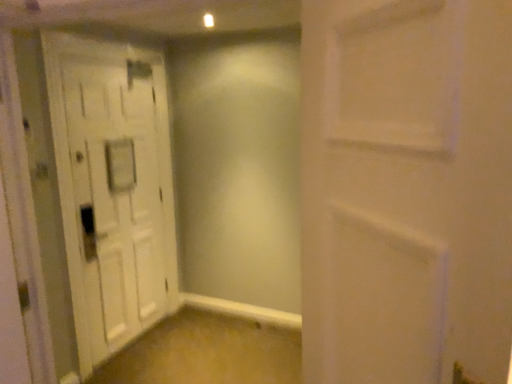
Question: From a real-world perspective, is white matte door at center, acting as the second door starting from the left, positioned above or below white wooden door at left, placed as the first door when sorted from back to front?

Choices:
 (A) below
 (B) above

Answer: (B)

Question: Based on their positions, is white matte door at center, which is the first door from front to back, located to the left or right of white wooden door at left, the first door in the left-to-right sequence?

Choices:
 (A) left
 (B) right

Answer: (B)

Question: Looking at their shapes, would you say white matte door at center, which ranks as the 1th door in right-to-left order, is wider or thinner than white wooden door at left, the 2th door positioned from the right?

Choices:
 (A) thin
 (B) wide

Answer: (A)

Question: Which is correct: white wooden door at left, the first door in the left-to-right sequence, is inside white matte door at center, acting as the second door starting from the left, or outside of it?

Choices:
 (A) outside
 (B) inside

Answer: (A)

Question: In the image, is white wooden door at left, which appears as the second door when viewed from the front, positioned in front of or behind white matte door at center, acting as the second door starting from the left?

Choices:
 (A) behind
 (B) front

Answer: (A)

Question: Is white wooden door at left, placed as the first door when sorted from back to front, bigger or smaller than white matte door at center, the second door from the back?

Choices:
 (A) small
 (B) big

Answer: (B)

Question: Is white wooden door at left, the first door in the left-to-right sequence, taller or shorter than white matte door at center, the second door from the back?

Choices:
 (A) short
 (B) tall

Answer: (B)